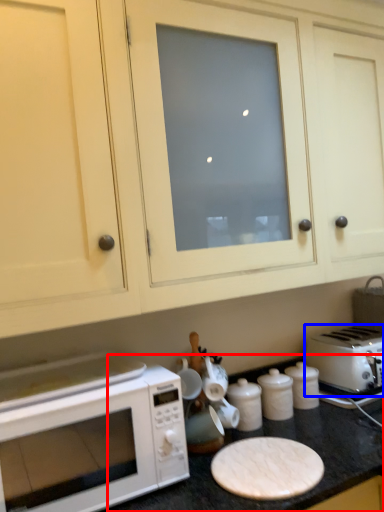
Question: Which of the following is the closest to the observer, counter top (highlighted by a red box) or toaster (highlighted by a blue box)?

Choices:
 (A) counter top
 (B) toaster

Answer: (A)